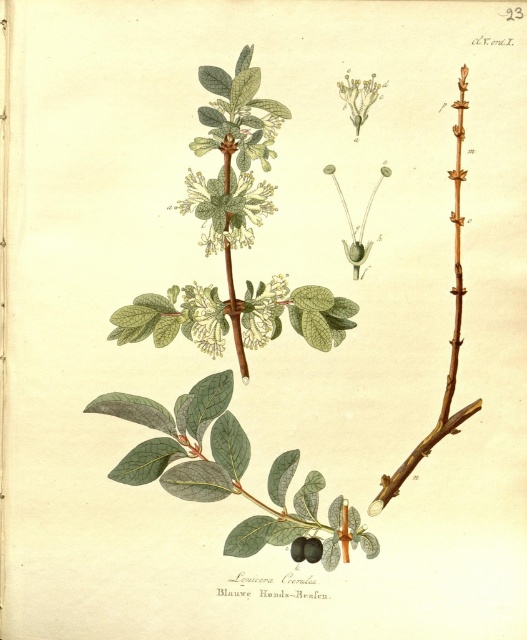
Question: Which point is closer to the camera?

Choices:
 (A) (310, 547)
 (B) (192, 285)
 (C) (297, 561)

Answer: (C)

Question: Does white matte flower at center appear over green leafy plant at upper center?

Choices:
 (A) yes
 (B) no

Answer: (B)

Question: Is brown matte branch at upper right to the left of green leafy plant at upper center from the viewer's perspective?

Choices:
 (A) no
 (B) yes

Answer: (A)

Question: Does shiny purple fruit at center appear on the right side of smooth dark purple fruit at center?

Choices:
 (A) no
 (B) yes

Answer: (B)

Question: Which object appears farthest from the camera in this image?

Choices:
 (A) brown matte branch at upper right
 (B) green leafy plant at upper center

Answer: (B)

Question: Which of the following is the closest to the observer?

Choices:
 (A) (219, 316)
 (B) (304, 541)
 (C) (298, 561)

Answer: (C)